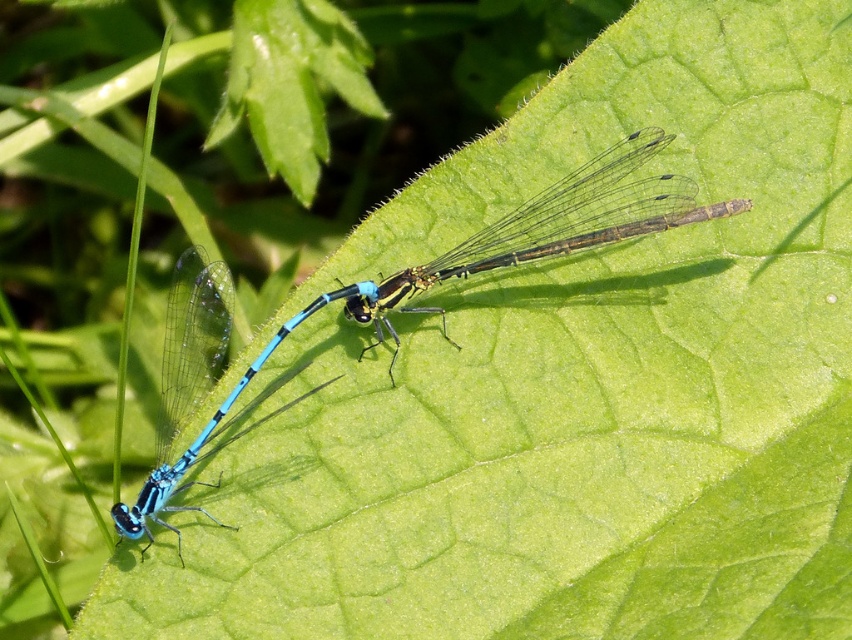
Question: Among these objects, which one is nearest to the camera?

Choices:
 (A) blue glossy dragonfly at center
 (B) blue translucent wings at left

Answer: (B)

Question: Which object is closer to the camera taking this photo?

Choices:
 (A) blue translucent wings at left
 (B) blue glossy dragonfly at center

Answer: (A)

Question: Can you confirm if blue glossy dragonfly at center is bigger than blue translucent wings at left?

Choices:
 (A) no
 (B) yes

Answer: (B)

Question: Is blue glossy dragonfly at center behind blue translucent wings at left?

Choices:
 (A) no
 (B) yes

Answer: (B)

Question: Is blue glossy dragonfly at center further to the viewer compared to blue translucent wings at left?

Choices:
 (A) yes
 (B) no

Answer: (A)